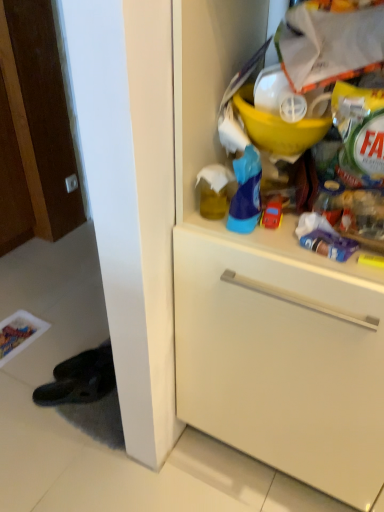
Question: From the image's perspective, is red plastic toy car at center beneath white matte cabinet at upper right?

Choices:
 (A) no
 (B) yes

Answer: (A)

Question: Considering the relative sizes of red plastic toy car at center and white matte cabinet at upper right in the image provided, is red plastic toy car at center shorter than white matte cabinet at upper right?

Choices:
 (A) yes
 (B) no

Answer: (A)

Question: Is red plastic toy car at center next to white matte cabinet at upper right?

Choices:
 (A) yes
 (B) no

Answer: (B)

Question: Is red plastic toy car at center facing away from white matte cabinet at upper right?

Choices:
 (A) yes
 (B) no

Answer: (A)

Question: Does red plastic toy car at center have a lesser width compared to white matte cabinet at upper right?

Choices:
 (A) no
 (B) yes

Answer: (B)

Question: Does red plastic toy car at center appear on the right side of white matte cabinet at upper right?

Choices:
 (A) no
 (B) yes

Answer: (A)

Question: Can you confirm if white matte cabinet at upper right is taller than red plastic toy car at center?

Choices:
 (A) yes
 (B) no

Answer: (A)

Question: Is white matte cabinet at upper right aimed at red plastic toy car at center?

Choices:
 (A) no
 (B) yes

Answer: (B)

Question: From a real-world perspective, is white matte cabinet at upper right on red plastic toy car at center?

Choices:
 (A) yes
 (B) no

Answer: (B)

Question: Is white matte cabinet at upper right touching red plastic toy car at center?

Choices:
 (A) no
 (B) yes

Answer: (A)

Question: Considering the relative sizes of white matte cabinet at upper right and red plastic toy car at center in the image provided, is white matte cabinet at upper right shorter than red plastic toy car at center?

Choices:
 (A) no
 (B) yes

Answer: (A)

Question: From the image's perspective, is white matte cabinet at upper right over red plastic toy car at center?

Choices:
 (A) no
 (B) yes

Answer: (A)

Question: Is point (362, 386) positioned closer to the camera than point (274, 214)?

Choices:
 (A) closer
 (B) farther

Answer: (A)